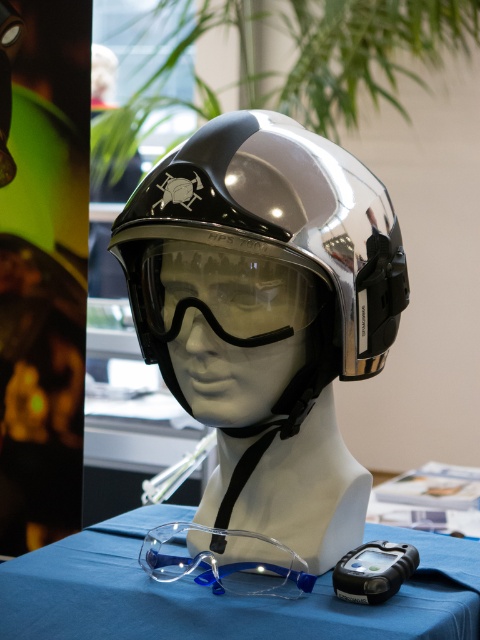
Between point (253, 152) and point (217, 624), which one is positioned behind?

Positioned behind is point (253, 152).

Does shiny metallic helmet at center have a lesser width compared to clear plastic safety glasses at lower center?

Yes.

This screenshot has height=640, width=480. What do you see at coordinates (266, 250) in the screenshot? I see `shiny metallic helmet at center` at bounding box center [266, 250].

This screenshot has width=480, height=640. What are the coordinates of `shiny metallic helmet at center` in the screenshot? It's located at (266, 250).

Can you confirm if shiny metallic helmet at center is thinner than transparent plastic goggles at lower center?

No, shiny metallic helmet at center is not thinner than transparent plastic goggles at lower center.

How far apart are shiny metallic helmet at center and transparent plastic goggles at lower center?

shiny metallic helmet at center is 33.29 centimeters away from transparent plastic goggles at lower center.

Image resolution: width=480 pixels, height=640 pixels. Find the location of `shiny metallic helmet at center`. shiny metallic helmet at center is located at coordinates (266, 250).

From the picture: Does clear plastic safety glasses at lower center appear over transparent plastic goggles at lower center?

No, clear plastic safety glasses at lower center is not above transparent plastic goggles at lower center.

Where is `clear plastic safety glasses at lower center`? This screenshot has width=480, height=640. clear plastic safety glasses at lower center is located at coordinates (223, 595).

Is point (439, 632) farther from camera compared to point (242, 540)?

No, (439, 632) is closer to viewer.

At what (x,y) coordinates should I click in order to perform the action: click on clear plastic safety glasses at lower center. Please return your answer as a coordinate pair (x, y). The image size is (480, 640). Looking at the image, I should click on (223, 595).